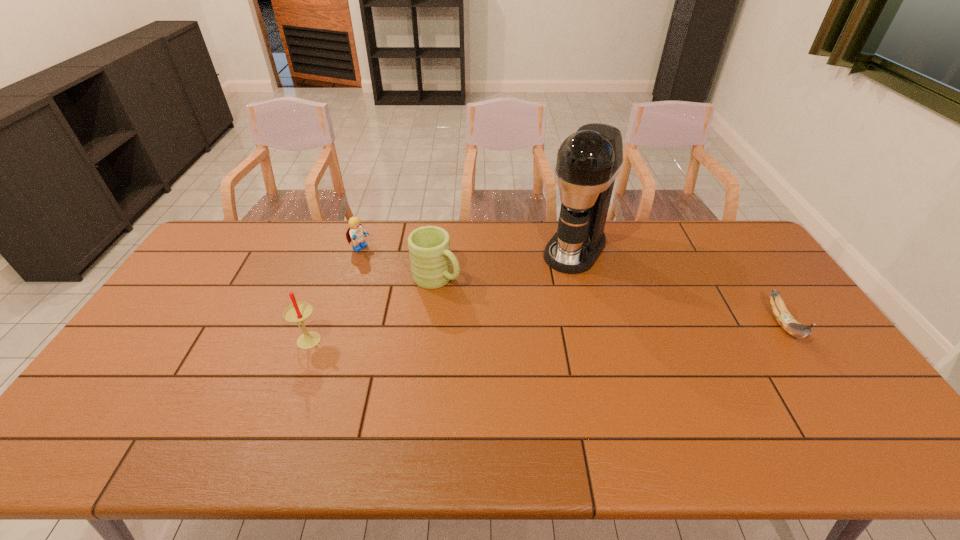
The width and height of the screenshot is (960, 540). In order to click on free point between the shortest object and the second tallest object in this screenshot , I will do `click(545, 332)`.

In order to click on empty space that is in between the tallest object and the candle in this screenshot , I will do `click(442, 294)`.

Locate an element on the screen. vacant space in between the third tallest object and the fourth shortest object is located at coordinates (372, 309).

This screenshot has width=960, height=540. In order to click on free space between the third object from left to right and the candle in this screenshot , I will do `click(372, 309)`.

What are the coordinates of `vacant area that lies between the rightmost object and the fourth tallest object` in the screenshot? It's located at (571, 287).

Identify the location of vacant region between the second tallest object and the coffee maker. (442, 294).

Find the location of a particular element. The width and height of the screenshot is (960, 540). free space between the banana and the tallest object is located at coordinates (679, 287).

I want to click on object that ranks as the third closest to the fourth tallest object, so click(x=588, y=161).

Select which object appears as the fourth closest to the second shortest object. Please provide its 2D coordinates. Your answer should be formatted as a tuple, i.e. [(x, y)], where the tuple contains the x and y coordinates of a point satisfying the conditions above.

[(785, 319)]

Identify the location of free space that satisfies the following two spatial constraints: 1. on the back side of the Lego; 2. on the left side of the coffee maker. This screenshot has height=540, width=960. (360, 249).